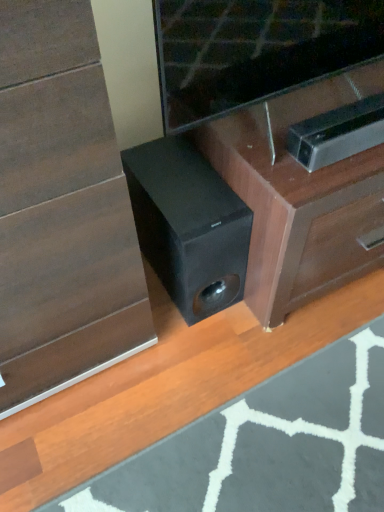
Measure the distance between point (353, 400) and camera.

The depth of point (353, 400) is 1.10 meters.

The width and height of the screenshot is (384, 512). In order to click on gray textured rug at lower center in this screenshot , I will do `click(267, 445)`.

Describe the element at coordinates (267, 445) in the screenshot. I see `gray textured rug at lower center` at that location.

I want to click on gray textured rug at lower center, so click(267, 445).